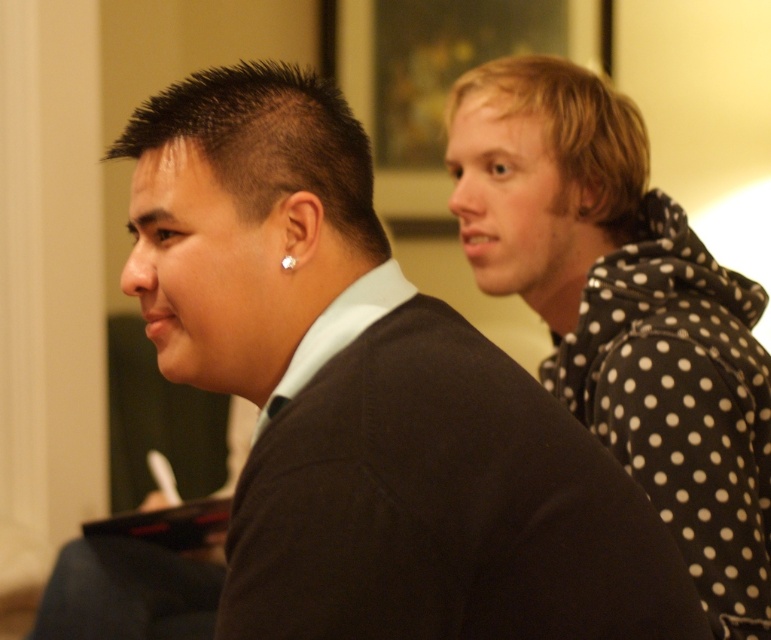
You are an interior designer observing the scene. You need to place a small decorative item between the dark brown knit sweater at center and the silver metallic earring at left. Based on their positions, where should you place the item to ensure it is between them?

The dark brown knit sweater at center is positioned under the silver metallic earring at left, so placing the decorative item between them would require positioning it above the sweater and below the earring.

You are an interior designer measuring the distance between objects in a room. You see the black polka dot hoodie at right and the silver metallic earring at left. Can you fit a 70 cm wide decorative shelf between them?

The black polka dot hoodie at right and silver metallic earring at left are 70.99 centimeters apart. Since the shelf is 70 cm wide, it can fit between them with a small gap of 0.99 centimeters remaining.